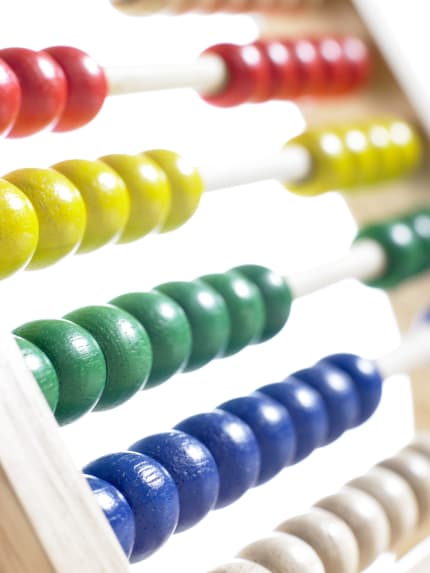
Locate an element on the screen. The image size is (430, 573). yellow abacus beads is located at coordinates (27, 241), (73, 219), (114, 218), (141, 203), (187, 196), (324, 174), (362, 162), (392, 156), (411, 152).